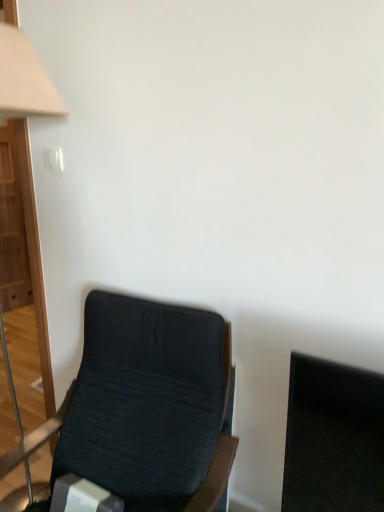
What is the approximate height of beige fabric lampshade at left?

beige fabric lampshade at left is 1.82 meters tall.

In order to face beige fabric lampshade at left, should I rotate leftwards or rightwards?

A 23.161 degree turn to the left will do.

What do you see at coordinates (24, 79) in the screenshot? The image size is (384, 512). I see `beige fabric lampshade at left` at bounding box center [24, 79].

At what (x,y) coordinates should I click in order to perform the action: click on beige fabric lampshade at left. Please return your answer as a coordinate pair (x, y). This screenshot has height=512, width=384. Looking at the image, I should click on (24, 79).

What do you see at coordinates (145, 406) in the screenshot?
I see `dark fabric chair at lower left` at bounding box center [145, 406].

What is the approximate width of dark fabric chair at lower left?

dark fabric chair at lower left is 32.10 inches wide.

The height and width of the screenshot is (512, 384). What are the coordinates of `dark fabric chair at lower left` in the screenshot? It's located at (145, 406).

The width and height of the screenshot is (384, 512). In order to click on beige fabric lampshade at left in this screenshot , I will do `click(24, 79)`.

Considering the positions of objects dark fabric chair at lower left and beige fabric lampshade at left in the image provided, who is more to the right, dark fabric chair at lower left or beige fabric lampshade at left?

dark fabric chair at lower left is more to the right.

Consider the image. Between dark fabric chair at lower left and beige fabric lampshade at left, which one is positioned behind?

beige fabric lampshade at left is further away from the camera.

Is point (200, 357) positioned before point (7, 377)?

Yes, it is in front of point (7, 377).

From the image's perspective, who appears lower, dark fabric chair at lower left or beige fabric lampshade at left?

dark fabric chair at lower left is shown below in the image.

From a real-world perspective, is dark fabric chair at lower left on top of beige fabric lampshade at left?

No, from a real-world perspective, dark fabric chair at lower left is not over beige fabric lampshade at left

Which object is wider, dark fabric chair at lower left or beige fabric lampshade at left?

Wider between the two is dark fabric chair at lower left.

Considering the relative sizes of dark fabric chair at lower left and beige fabric lampshade at left in the image provided, is dark fabric chair at lower left taller than beige fabric lampshade at left?

In fact, dark fabric chair at lower left may be shorter than beige fabric lampshade at left.

Between dark fabric chair at lower left and beige fabric lampshade at left, which one has smaller size?

beige fabric lampshade at left is smaller.

Choose the correct answer: Is dark fabric chair at lower left inside beige fabric lampshade at left or outside it?

The correct answer is: outside.

Is dark fabric chair at lower left not near beige fabric lampshade at left?

No, dark fabric chair at lower left is not far away from beige fabric lampshade at left.

Is dark fabric chair at lower left facing towards beige fabric lampshade at left?

No, dark fabric chair at lower left is not turned towards beige fabric lampshade at left.

What's the angular difference between dark fabric chair at lower left and beige fabric lampshade at left's facing directions?

The angular difference between dark fabric chair at lower left and beige fabric lampshade at left is 0.113 degrees.

Locate an element on the screen. chair that appears below the beige fabric lampshade at left (from the image's perspective) is located at coordinates (145, 406).

Considering the positions of objects beige fabric lampshade at left and dark fabric chair at lower left in the image provided, who is more to the right, beige fabric lampshade at left or dark fabric chair at lower left?

Positioned to the right is dark fabric chair at lower left.

In the image, is beige fabric lampshade at left positioned in front of or behind dark fabric chair at lower left?

Visually, beige fabric lampshade at left is located behind dark fabric chair at lower left.

Which point is more forward, (x=31, y=106) or (x=89, y=372)?

The point (x=31, y=106) is closer.

From the image's perspective, which object appears higher, beige fabric lampshade at left or dark fabric chair at lower left?

From the image's view, beige fabric lampshade at left is above.

From a real-world perspective, between beige fabric lampshade at left and dark fabric chair at lower left, who is vertically higher?

beige fabric lampshade at left.

Can you confirm if beige fabric lampshade at left is wider than dark fabric chair at lower left?

No.

Is beige fabric lampshade at left taller or shorter than dark fabric chair at lower left?

In the image, beige fabric lampshade at left appears to be taller than dark fabric chair at lower left.

Does beige fabric lampshade at left have a smaller size compared to dark fabric chair at lower left?

Yes, beige fabric lampshade at left is smaller than dark fabric chair at lower left.

Choose the correct answer: Is beige fabric lampshade at left inside dark fabric chair at lower left or outside it?

beige fabric lampshade at left lies outside dark fabric chair at lower left.

Is the surface of beige fabric lampshade at left in direct contact with dark fabric chair at lower left?

No, beige fabric lampshade at left is not touching dark fabric chair at lower left.

In the scene shown: Is beige fabric lampshade at left facing towards dark fabric chair at lower left?

No, beige fabric lampshade at left is not aimed at dark fabric chair at lower left.

Locate an element on the screen. This screenshot has height=512, width=384. chair below the beige fabric lampshade at left (from a real-world perspective) is located at coordinates (145, 406).

The image size is (384, 512). Identify the location of chair on the right of beige fabric lampshade at left. (145, 406).

Locate an element on the screen. This screenshot has height=512, width=384. table lamp located on the left of dark fabric chair at lower left is located at coordinates (24, 79).